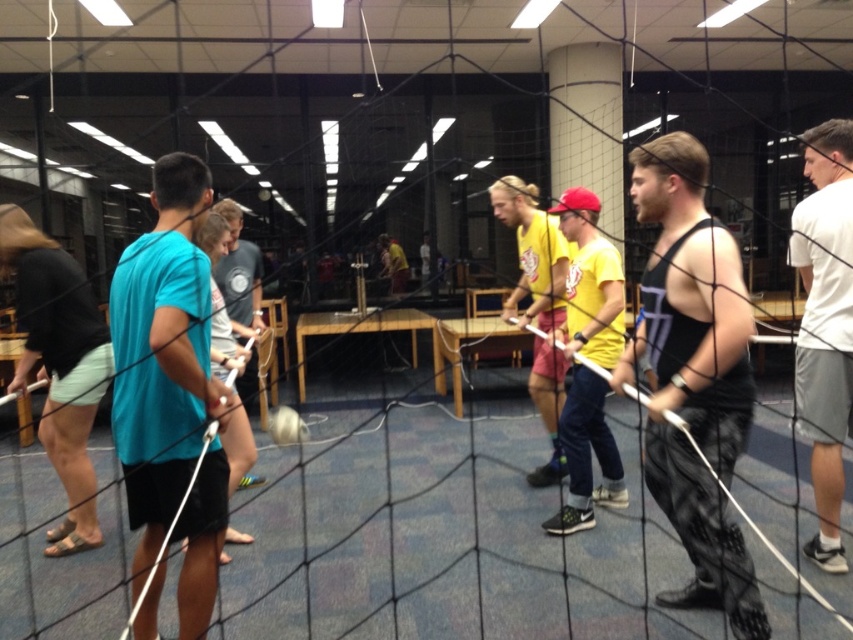
Question: Observing the image, what is the correct spatial positioning of yellow cotton shirt at center in reference to light blue fabric shirt at center?

Choices:
 (A) above
 (B) below

Answer: (B)

Question: Is white cotton t-shirt at right wider than yellow matte t-shirt at center?

Choices:
 (A) no
 (B) yes

Answer: (A)

Question: Is black tank top at center further to the viewer compared to yellow cotton shirt at center?

Choices:
 (A) yes
 (B) no

Answer: (B)

Question: Which object appears closest to the camera in this image?

Choices:
 (A) white cotton t-shirt at right
 (B) yellow cotton shirt at center

Answer: (A)

Question: Which point appears farthest from the camera in this image?

Choices:
 (A) coord(593,323)
 (B) coord(666,474)

Answer: (A)

Question: Which object is closer to the camera taking this photo?

Choices:
 (A) teal matte t-shirt at left
 (B) yellow cotton shirt at center
 (C) yellow matte t-shirt at center
 (D) yellow t-shirt at center

Answer: (A)